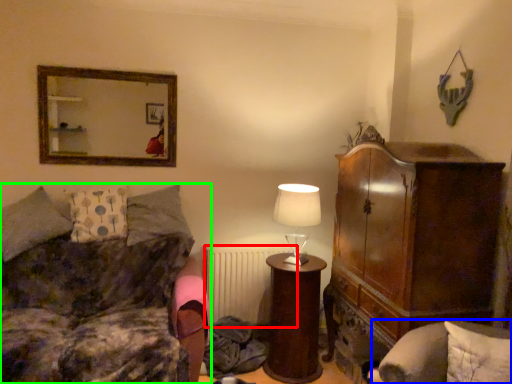
Question: Which is nearer to the radiator (highlighted by a red box)? swivel chair (highlighted by a blue box) or studio couch (highlighted by a green box).

Choices:
 (A) swivel chair
 (B) studio couch

Answer: (B)